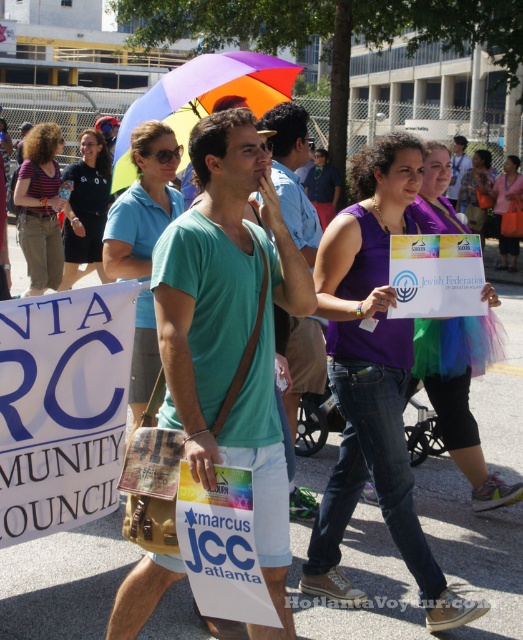
In the scene shown: You are a photographer standing at the edge of the crowd, wanting to capture both the blue paper sign at upper left and the matte purple shirt at center in a single photo. Given that your camera has a 60 feet focal length, will you be able to include both objects in your shot?

The blue paper sign at upper left and the matte purple shirt at center are 42.68 feet apart. Since the camera has a 60 feet focal length, which is wider than the distance between them, both objects can be included in the photo.

You are a photographer standing at the center of the scene. You want to take a photo that includes both the point at (165,248) and the point at (35,515). Which point should you focus on to ensure both are in sharp focus?

You should focus on the point at (165,248) because it is closer to the camera than the point at (35,515). By focusing on the closer point, the depth of field will likely include the farther point as well, ensuring both are in sharp focus.